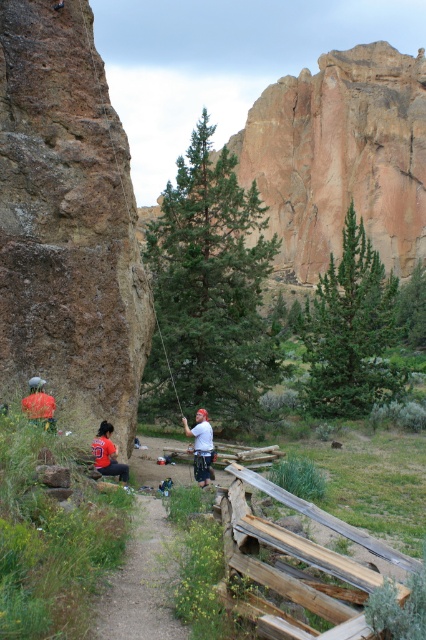
Looking at this image, you are standing at point (160, 531) and want to move to the wooden fence. The wooden fence is located at point (270, 358). Since you can only move forward, will you be able to see the wooden fence while moving towards it?

Point (270, 358) is behind point (160, 531), so when moving forward from point (160, 531) towards the wooden fence at point (270, 358), you will not be able to see the wooden fence because it is behind your current position.

You are a hiker planning to walk along the dirt path at center. There is a brown rough rock at left in your way. Can you walk around it on the path?

The brown rough rock at left is positioned over the dirt path at center, blocking the path. To walk around it, you would need to go around either the left or right side of the brown rough rock at left while staying on the dirt path at center.